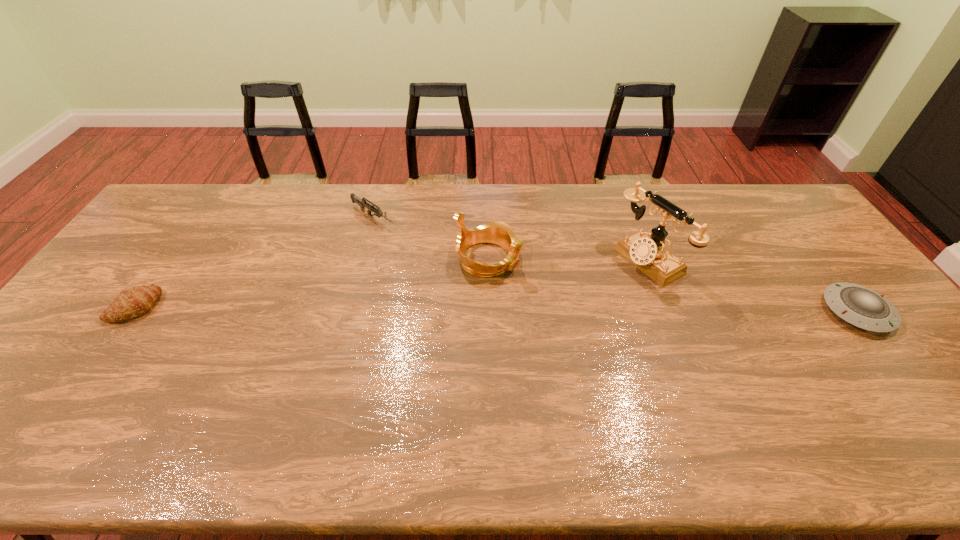
At what (x,y) coordinates should I click in order to perform the action: click on vacant space located 0.180m on the front of the rightmost object. Please return your answer as a coordinate pair (x, y). The width and height of the screenshot is (960, 540). Looking at the image, I should click on (925, 400).

Locate an element on the screen. The height and width of the screenshot is (540, 960). vacant space located aimed along the barrel of the farthest object is located at coordinates (459, 272).

This screenshot has height=540, width=960. What are the coordinates of `vacant space located aimed along the barrel of the farthest object` in the screenshot? It's located at pyautogui.click(x=420, y=247).

At what (x,y) coordinates should I click in order to perform the action: click on free space located aimed along the barrel of the farthest object. Please return your answer as a coordinate pair (x, y). The width and height of the screenshot is (960, 540). Looking at the image, I should click on (464, 275).

Where is `vacant area situated 0.150m at the front emblem of the fourth shortest object`? This screenshot has width=960, height=540. vacant area situated 0.150m at the front emblem of the fourth shortest object is located at coordinates (559, 293).

This screenshot has width=960, height=540. I want to click on free space located 0.110m at the front emblem of the fourth shortest object, so (x=546, y=287).

You are a GUI agent. You are given a task and a screenshot of the screen. Output one action in this format:
    pyautogui.click(x=<x>, y=<y>)
    Task: Click on the free location located at the front emblem of the fourth shortest object
    The image size is (960, 540).
    Given the screenshot: What is the action you would take?
    pyautogui.click(x=540, y=284)

Locate an element on the screen. The width and height of the screenshot is (960, 540). vacant space located on the dial of the telephone is located at coordinates (602, 289).

The width and height of the screenshot is (960, 540). What are the coordinates of `free space located on the dial of the telephone` in the screenshot? It's located at (570, 307).

What are the coordinates of `vacant space situated 0.210m on the dial of the telephone` in the screenshot? It's located at (573, 305).